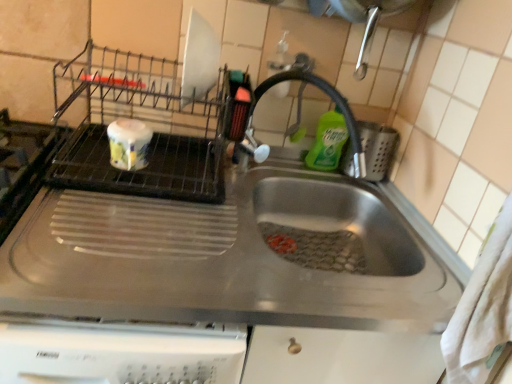
Identify the location of vacant area in front of green liquid soap at upper right. The image size is (512, 384). (325, 183).